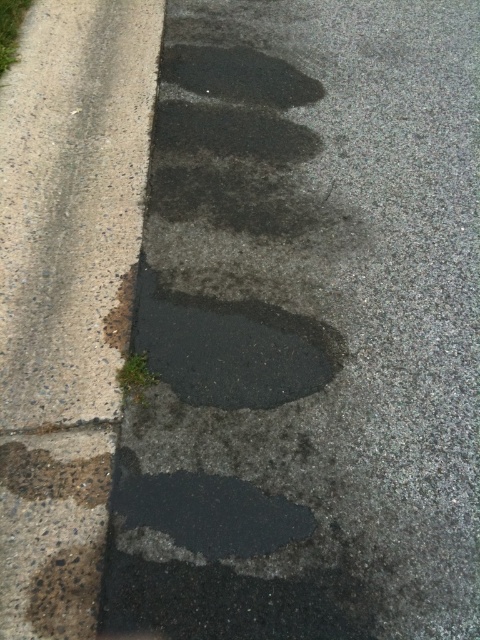
Does dark gray concrete at lower left appear on the right side of dark gray asphalt crack at lower left?

Correct, you'll find dark gray concrete at lower left to the right of dark gray asphalt crack at lower left.

Find the location of a particular element. Image resolution: width=480 pixels, height=640 pixels. dark gray concrete at lower left is located at coordinates (67, 593).

You are a GUI agent. You are given a task and a screenshot of the screen. Output one action in this format:
    pyautogui.click(x=<x>, y=<y>)
    Task: Click on the dark gray concrete at lower left
    This screenshot has height=640, width=480.
    Given the screenshot: What is the action you would take?
    pyautogui.click(x=67, y=593)

Between point (255, 401) and point (288, 524), which one is positioned behind?

Positioned behind is point (255, 401).

Which is in front, point (203, 308) or point (280, 502)?

Point (280, 502)

What are the coordinates of `black asphalt puddle at center` in the screenshot? It's located at (230, 348).

Is black asphalt puddle at center further to the viewer compared to rusty metal footprint at lower left?

No, black asphalt puddle at center is in front of rusty metal footprint at lower left.

Does black asphalt puddle at center have a lesser width compared to rusty metal footprint at lower left?

No.

What are the coordinates of `black asphalt puddle at center` in the screenshot? It's located at (230, 348).